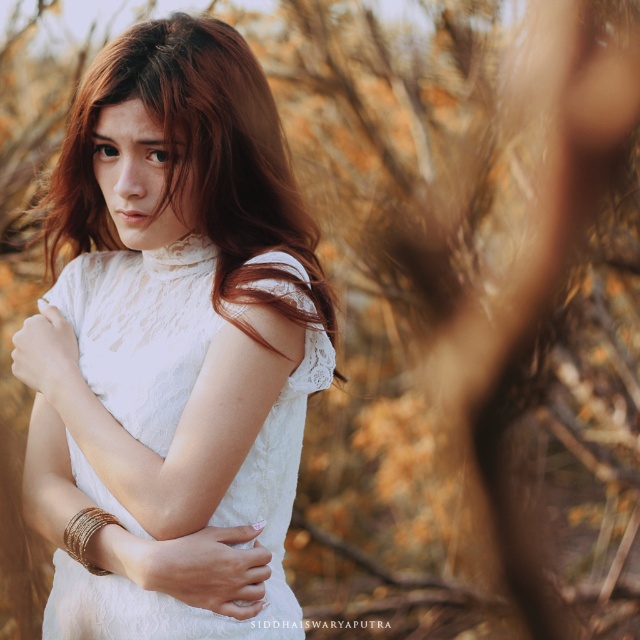
Who is shorter, gold metallic bangles at center or gold metallic bracelet at lower left?

Standing shorter between the two is gold metallic bracelet at lower left.

Consider the image. Is gold metallic bangles at center closer to the viewer compared to gold metallic bracelet at lower left?

Yes, it is in front of gold metallic bracelet at lower left.

Which is in front, point (36, 448) or point (90, 509)?

Point (90, 509) is in front.

At what (x,y) coordinates should I click in order to perform the action: click on gold metallic bangles at center. Please return your answer as a coordinate pair (x, y). Looking at the image, I should click on (189, 566).

Is white lace dress at center further to the viewer compared to gold metallic bracelet at lower left?

No, white lace dress at center is in front of gold metallic bracelet at lower left.

Can you confirm if white lace dress at center is positioned above gold metallic bracelet at lower left?

Yes.

Find the location of `white lace dress at center`. white lace dress at center is located at coordinates (173, 324).

Find the location of a particular element. This screenshot has width=640, height=640. white lace dress at center is located at coordinates (173, 324).

Is the position of white lace dress at center more distant than that of gold metallic bangles at center?

No.

Is point (266, 362) closer to camera compared to point (196, 577)?

No, (266, 362) is behind (196, 577).

In order to click on white lace dress at center in this screenshot , I will do `click(173, 324)`.